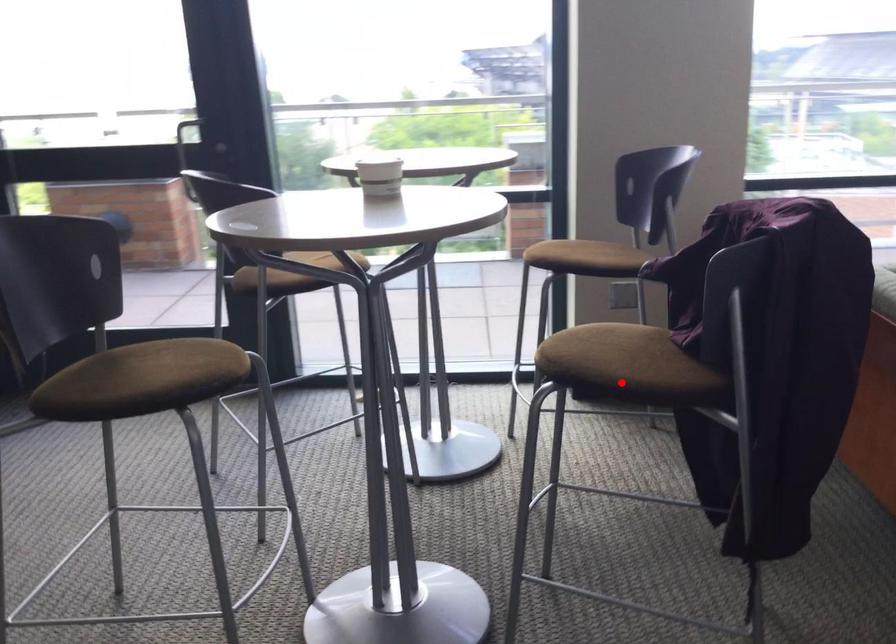
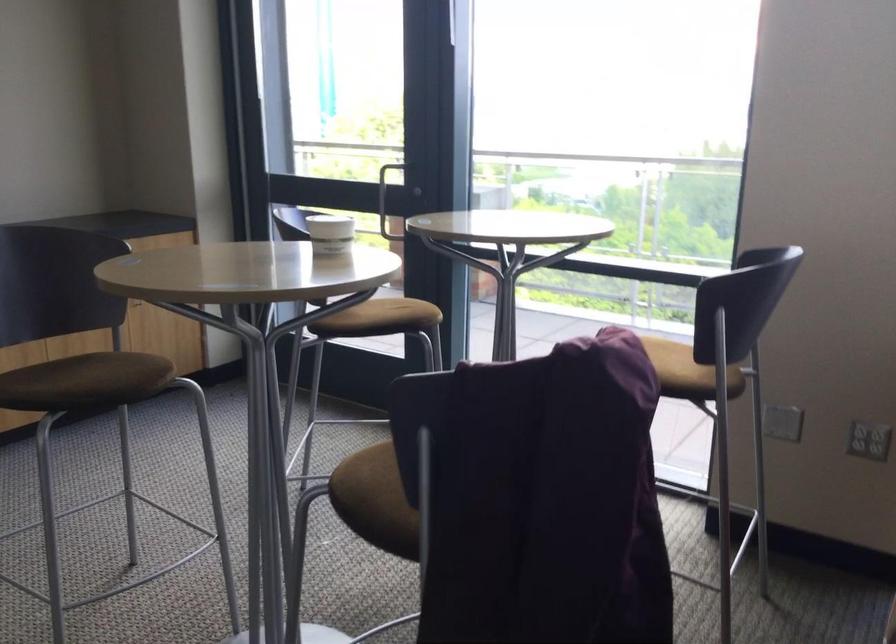
Question: A red point is marked in image1. In image2, is the corresponding 3D point closer to the camera or farther? Reply with the corresponding letter.

Choices:
 (A) The corresponding 3D point is closer.
 (B) The corresponding 3D point is farther.

Answer: (A)